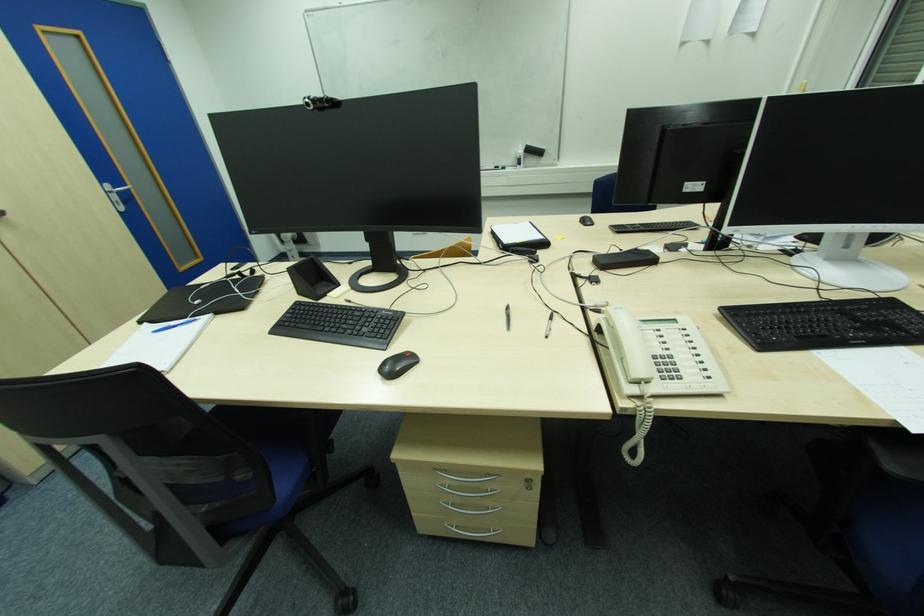
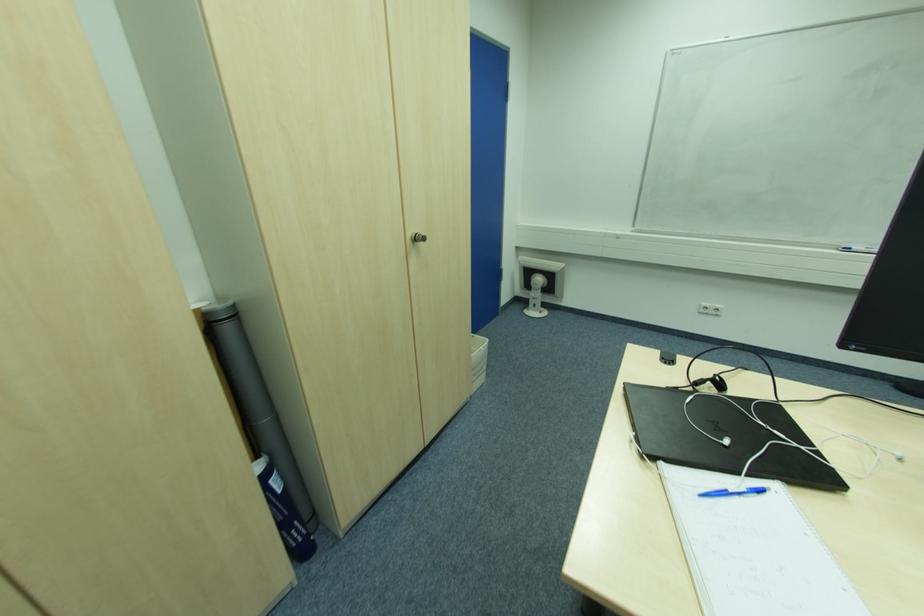
Find the pixel in the second image that matches point (148, 325) in the first image.

(663, 464)